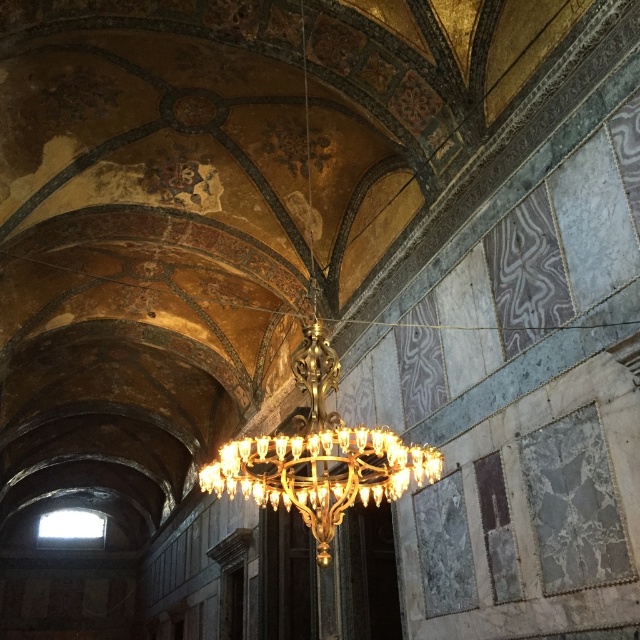
Is gold metallic chandelier at center further to camera compared to gold/glass chandelier at center?

Yes, gold metallic chandelier at center is further from the viewer.

Is gold metallic chandelier at center below gold/glass chandelier at center?

No.

Between point (305, 524) and point (333, 470), which one is positioned in front?

Point (333, 470) is in front.

I want to click on gold metallic chandelier at center, so click(317, 436).